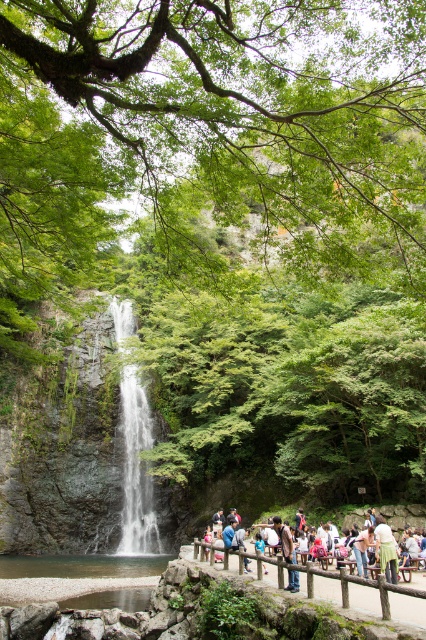
Does white glossy waterfall at center have a lesser width compared to green fabric dress at center?

No.

Does white glossy waterfall at center appear on the right side of green fabric dress at center?

Incorrect, white glossy waterfall at center is not on the right side of green fabric dress at center.

The width and height of the screenshot is (426, 640). Describe the element at coordinates (135, 468) in the screenshot. I see `white glossy waterfall at center` at that location.

This screenshot has height=640, width=426. In order to click on white glossy waterfall at center in this screenshot , I will do `click(135, 468)`.

From the picture: Is wooden fence at center shorter than green fabric dress at center?

In fact, wooden fence at center may be taller than green fabric dress at center.

Identify the location of wooden fence at center. The width and height of the screenshot is (426, 640). (333, 576).

Where is `wooden fence at center`? Image resolution: width=426 pixels, height=640 pixels. wooden fence at center is located at coordinates (333, 576).

Between white glossy waterfall at center and wooden fence at center, which one has more height?

white glossy waterfall at center is taller.

Who is more forward, (137, 506) or (264, 560)?

Point (264, 560) is more forward.

At what (x,y) coordinates should I click in order to perform the action: click on white glossy waterfall at center. Please return your answer as a coordinate pair (x, y). Image resolution: width=426 pixels, height=640 pixels. Looking at the image, I should click on (135, 468).